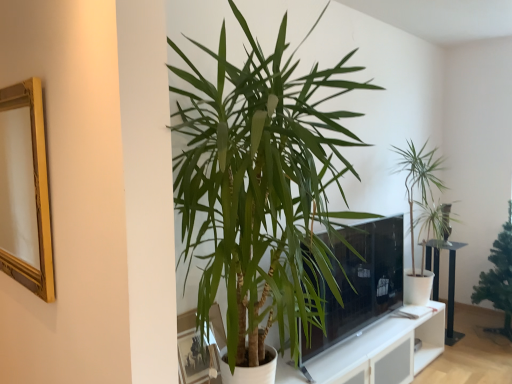
What do you see at coordinates (448, 281) in the screenshot? I see `black metal table at right` at bounding box center [448, 281].

The image size is (512, 384). What are the coordinates of `matte glass picture frame at lower center, acting as the second picture frame starting from the left` in the screenshot? It's located at (185, 353).

The image size is (512, 384). Identify the location of green leafy plant at right, the 2th houseplant in the left-to-right sequence. (418, 179).

From a real-world perspective, between black metal table at right and green leafy plant at right, which is the third houseplant from front to back, who is vertically higher?

In real-world perspective, green leafy plant at right, which is the third houseplant from front to back, is above.

Which houseplant is the 1st one when counting from the front of the black metal table at right? Please provide its 2D coordinates.

[(498, 278)]

Considering the positions of objects black metal table at right and green leafy plant at right, which is the third houseplant from front to back, in the image provided, who is in front, black metal table at right or green leafy plant at right, which is the third houseplant from front to back,?

green leafy plant at right, which is the third houseplant from front to back, is in front.

From a real-world perspective, which is physically above, gold wood picture frame at left, the 2th picture frame in the bottom-to-top sequence, or matte glass picture frame at lower center, which appears as the 1th picture frame when ordered from the bottom?

In real-world perspective, gold wood picture frame at left, the 2th picture frame in the bottom-to-top sequence, is above.

Who is taller, gold wood picture frame at left, positioned as the 2th picture frame in right-to-left order, or matte glass picture frame at lower center, acting as the second picture frame starting from the left?

gold wood picture frame at left, positioned as the 2th picture frame in right-to-left order.

In the scene shown: Is gold wood picture frame at left, arranged as the 1th picture frame when viewed from the top, oriented away from matte glass picture frame at lower center, acting as the second picture frame starting from the left?

No, gold wood picture frame at left, arranged as the 1th picture frame when viewed from the top,'s orientation is not away from matte glass picture frame at lower center, acting as the second picture frame starting from the left.

Does green leafy plant at right, acting as the third houseplant starting from the left, appear on the right side of matte glass picture frame at lower center, which appears as the 1th picture frame when ordered from the bottom?

Indeed, green leafy plant at right, acting as the third houseplant starting from the left, is positioned on the right side of matte glass picture frame at lower center, which appears as the 1th picture frame when ordered from the bottom.

Is green leafy plant at right, which appears as the first houseplant when viewed from the right, looking in the opposite direction of matte glass picture frame at lower center, the 2th picture frame from the top?

No.

Which is further, (494,247) or (212,309)?

Positioned behind is point (494,247).

Considering the sizes of green leafy plant at right, which is the third houseplant from front to back, and matte glass picture frame at lower center, which appears as the 1th picture frame when ordered from the bottom, in the image, is green leafy plant at right, which is the third houseplant from front to back, wider or thinner than matte glass picture frame at lower center, which appears as the 1th picture frame when ordered from the bottom,?

Considering their sizes, green leafy plant at right, which is the third houseplant from front to back, looks broader than matte glass picture frame at lower center, which appears as the 1th picture frame when ordered from the bottom.

Is black metal table at right taller than gold wood picture frame at left, positioned as the 2th picture frame in right-to-left order?

No.

Consider the image. Is black metal table at right inside or outside of gold wood picture frame at left, the 2th picture frame in the bottom-to-top sequence?

black metal table at right lies outside gold wood picture frame at left, the 2th picture frame in the bottom-to-top sequence.

Is black metal table at right in front of or behind gold wood picture frame at left, arranged as the 1th picture frame when viewed from the top, in the image?

Clearly, black metal table at right is behind gold wood picture frame at left, arranged as the 1th picture frame when viewed from the top.

From a real-world perspective, count 2nd picture frames upward from the black metal table at right and point to it. Please provide its 2D coordinates.

[(25, 190)]

Based on the photo, considering the relative positions of black metal table at right and green leafy plant at right, the 2th houseplant in the left-to-right sequence, in the image provided, is black metal table at right to the left of green leafy plant at right, the 2th houseplant in the left-to-right sequence, from the viewer's perspective?

Incorrect, black metal table at right is not on the left side of green leafy plant at right, the 2th houseplant in the left-to-right sequence.

From the picture: Can green leafy plant at right, the 2th houseplant in the left-to-right sequence, be found inside black metal table at right?

That's incorrect, green leafy plant at right, the 2th houseplant in the left-to-right sequence, is not inside black metal table at right.

Is black metal table at right facing towards green leafy plant at right, the 2th houseplant when ordered from front to back?

No, black metal table at right is not aimed at green leafy plant at right, the 2th houseplant when ordered from front to back.

Is point (431, 240) less distant than point (410, 196)?

Yes, point (431, 240) is in front of point (410, 196).

Is gold wood picture frame at left, arranged as the 1th picture frame when viewed from the left, not close to black metal table at right?

Yes, gold wood picture frame at left, arranged as the 1th picture frame when viewed from the left, and black metal table at right are located far from each other.

Could you measure the distance between gold wood picture frame at left, the 2th picture frame in the bottom-to-top sequence, and black metal table at right?

The distance of gold wood picture frame at left, the 2th picture frame in the bottom-to-top sequence, from black metal table at right is 12.72 feet.

Considering the sizes of objects gold wood picture frame at left, the 2th picture frame in the bottom-to-top sequence, and black metal table at right in the image provided, who is taller, gold wood picture frame at left, the 2th picture frame in the bottom-to-top sequence, or black metal table at right?

With more height is gold wood picture frame at left, the 2th picture frame in the bottom-to-top sequence.

Looking at their sizes, would you say gold wood picture frame at left, positioned as the 2th picture frame in right-to-left order, is wider or thinner than black metal table at right?

Clearly, gold wood picture frame at left, positioned as the 2th picture frame in right-to-left order, has less width compared to black metal table at right.

Is green leafy plant at right, arranged as the second houseplant when viewed from the right, inside or outside of black metal table at right?

green leafy plant at right, arranged as the second houseplant when viewed from the right, cannot be found inside black metal table at right.

Find the location of a particular element. The width and height of the screenshot is (512, 384). table that appears below the green leafy plant at right, the 2th houseplant in the left-to-right sequence (from a real-world perspective) is located at coordinates (448, 281).

Is the position of green leafy plant at right, arranged as the second houseplant when viewed from the right, less distant than that of black metal table at right?

Yes.

How many degrees apart are the facing directions of green leafy plant at right, which is the second houseplant from back to front, and black metal table at right?

They differ by 0.483 degrees in their facing directions.

There is a black metal table at right. At what (x,y) coordinates should I click in order to perform the action: click on the 1st houseplant above it (from the image's perspective). Please return your answer as a coordinate pair (x, y). Looking at the image, I should click on (498, 278).

Identify the location of picture frame lying behind the gold wood picture frame at left, the 2th picture frame in the bottom-to-top sequence. (185, 353).

Considering their positions, is green leafy plant at right, which appears as the first houseplant when viewed from the right, positioned closer to green leafy plant at right, which is the second houseplant from back to front, than gold wood picture frame at left, arranged as the 1th picture frame when viewed from the left?

green leafy plant at right, which appears as the first houseplant when viewed from the right, is positioned closer to the anchor green leafy plant at right, which is the second houseplant from back to front.

Considering their positions, is green leafy plant at right, arranged as the second houseplant when viewed from the right, positioned closer to black metal table at right than green leafy plant at right, which is the third houseplant from front to back?

Among the two, green leafy plant at right, arranged as the second houseplant when viewed from the right, is located nearer to black metal table at right.

Based on their spatial positions, is green leafy plant at center, arranged as the 1th houseplant when viewed from the left, or black metal table at right closer to gold wood picture frame at left, arranged as the 1th picture frame when viewed from the top?

green leafy plant at center, arranged as the 1th houseplant when viewed from the left, is positioned closer to the anchor gold wood picture frame at left, arranged as the 1th picture frame when viewed from the top.

Based on their spatial positions, is transparent glass door at center or green leafy plant at center, which ranks as the first houseplant in front-to-back order, further from green leafy plant at right, the 2th houseplant when ordered from front to back?

green leafy plant at center, which ranks as the first houseplant in front-to-back order, is positioned further to the anchor green leafy plant at right, the 2th houseplant when ordered from front to back.

Based on their spatial positions, is green leafy plant at right, which appears as the first houseplant when viewed from the right, or black metal table at right closer to transparent glass door at center?

Among the two, black metal table at right is located nearer to transparent glass door at center.

Estimate the real-world distances between objects in this image. Which object is further from green leafy plant at center, which is the third houseplant in back-to-front order, matte glass picture frame at lower center, the 2th picture frame from the top, or transparent glass door at center?

transparent glass door at center is positioned further to the anchor green leafy plant at center, which is the third houseplant in back-to-front order.

Estimate the real-world distances between objects in this image. Which object is further from green leafy plant at right, the 2th houseplant when ordered from front to back, transparent glass door at center or matte glass picture frame at lower center, the first picture frame when ordered from right to left?

matte glass picture frame at lower center, the first picture frame when ordered from right to left, is positioned further to the anchor green leafy plant at right, the 2th houseplant when ordered from front to back.

Which object lies nearer to the anchor point gold wood picture frame at left, the 2th picture frame in the bottom-to-top sequence, matte glass picture frame at lower center, the 2th picture frame from the top, or black metal table at right?

matte glass picture frame at lower center, the 2th picture frame from the top, lies closer to gold wood picture frame at left, the 2th picture frame in the bottom-to-top sequence, than the other object.

Identify the location of houseplant between transparent glass door at center and green leafy plant at right, which is the third houseplant from front to back. (418, 179).

Locate an element on the screen. The height and width of the screenshot is (384, 512). houseplant between gold wood picture frame at left, arranged as the 1th picture frame when viewed from the top, and transparent glass door at center is located at coordinates (261, 189).

Where is `table between matte glass picture frame at lower center, the first picture frame when ordered from right to left, and green leafy plant at right, which appears as the first houseplant when viewed from the right`? The image size is (512, 384). table between matte glass picture frame at lower center, the first picture frame when ordered from right to left, and green leafy plant at right, which appears as the first houseplant when viewed from the right is located at coordinates (448, 281).

Locate an element on the screen. glass door between gold wood picture frame at left, positioned as the 2th picture frame in right-to-left order, and black metal table at right from left to right is located at coordinates (360, 282).